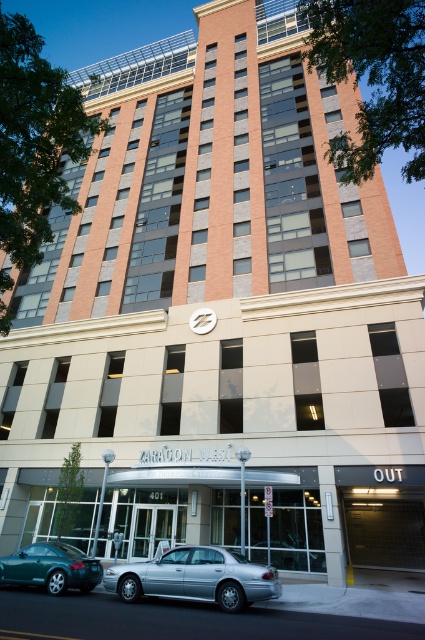
Is point (232, 552) positioned after point (54, 561)?

No, (232, 552) is closer to viewer.

Can you confirm if silver metallic sedan at lower center is shorter than green matte car at lower left?

No.

Is point (112, 589) farther from camera compared to point (68, 564)?

That is False.

You are a GUI agent. You are given a task and a screenshot of the screen. Output one action in this format:
    pyautogui.click(x=<x>, y=<y>)
    Task: Click on the silver metallic sedan at lower center
    The width and height of the screenshot is (425, 640).
    Given the screenshot: What is the action you would take?
    pyautogui.click(x=195, y=577)